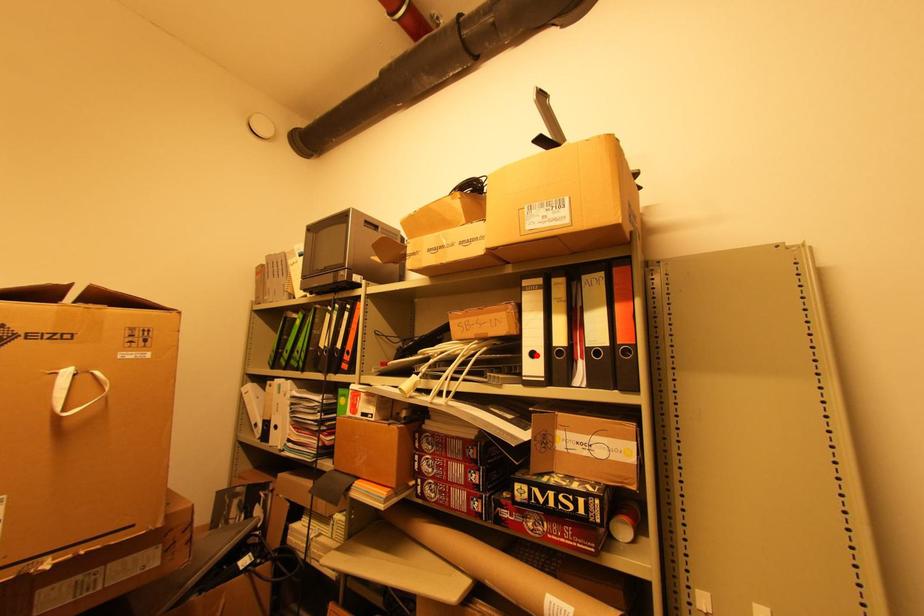
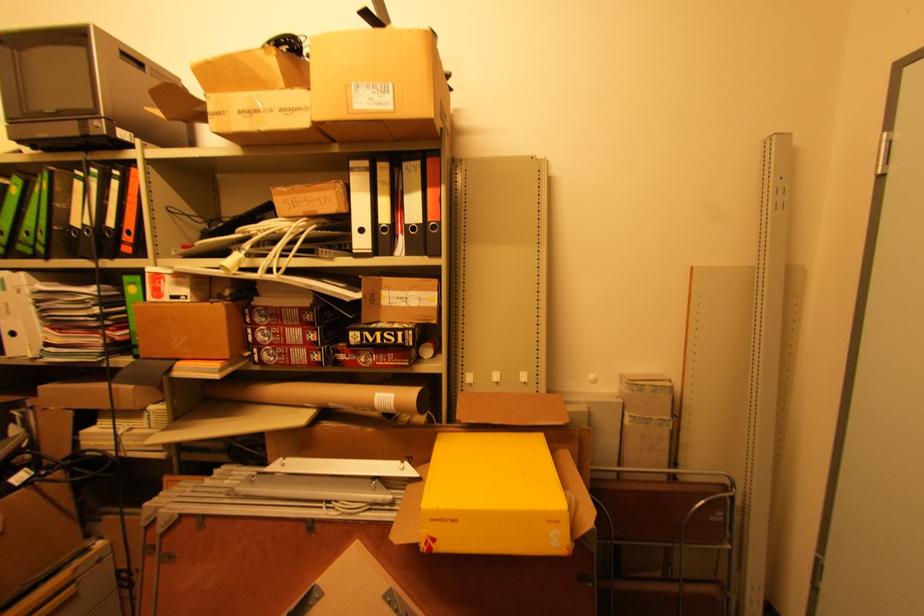
The point at the highlighted location is marked in the first image. Where is the corresponding point in the second image?

(365, 231)